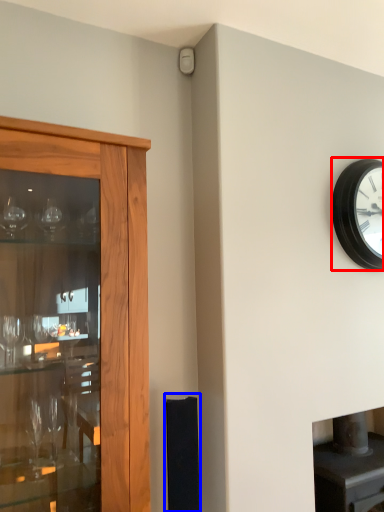
Question: Among these objects, which one is farthest to the camera, wall clock (highlighted by a red box) or speaker (highlighted by a blue box)?

Choices:
 (A) wall clock
 (B) speaker

Answer: (A)